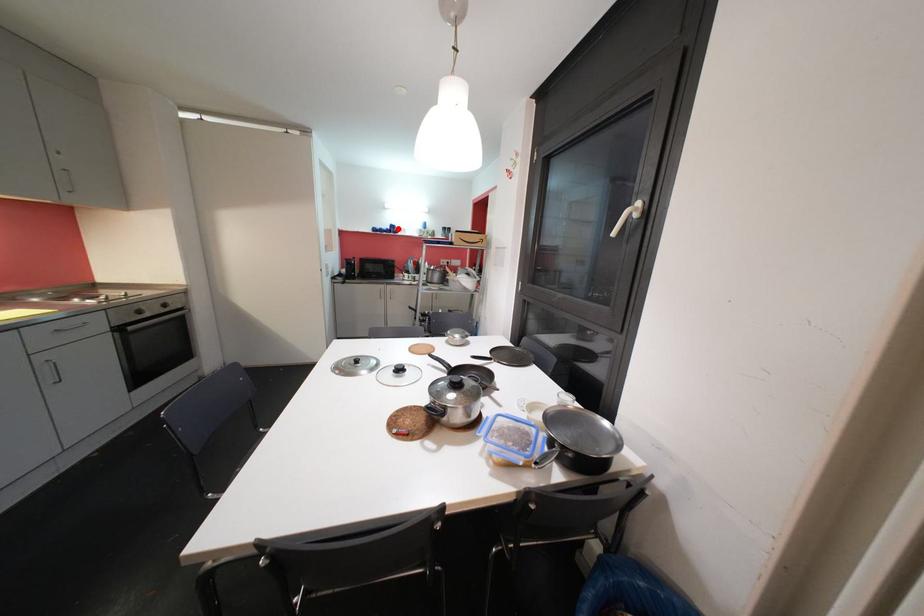
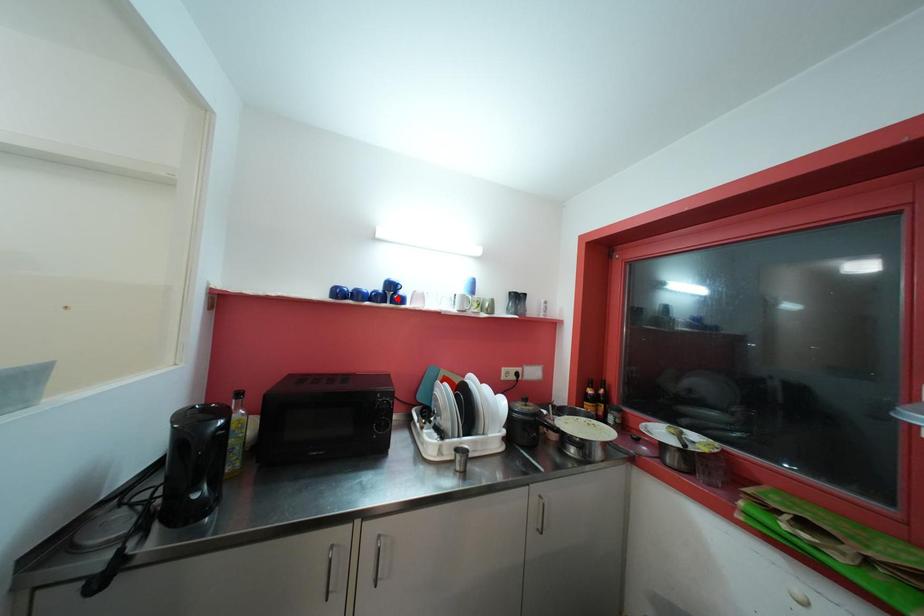
I am providing you with two images of the same scene from different viewpoints. A red point is marked on the first image and another point is marked on the second image. Are the points marked in image1 and image2 representing the same 3D position?

No